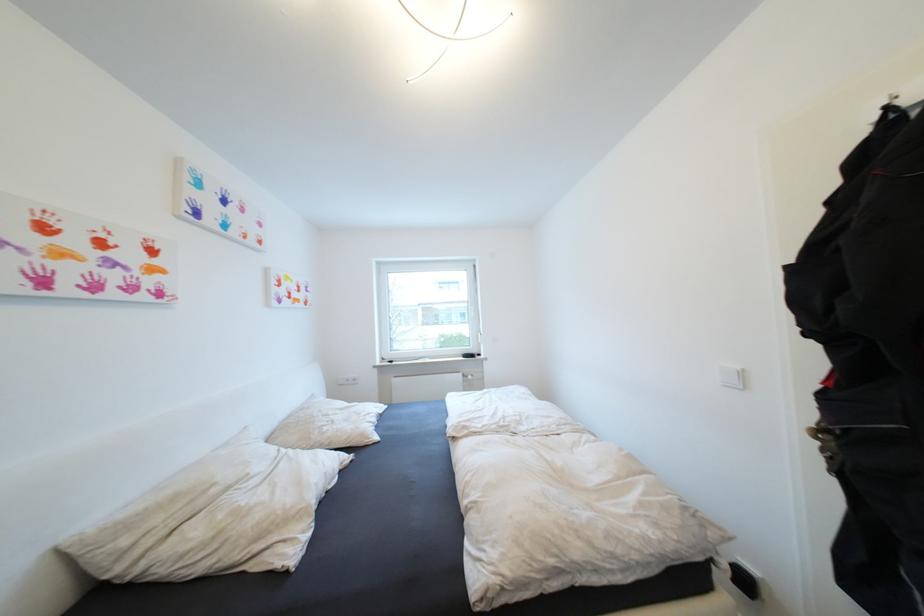
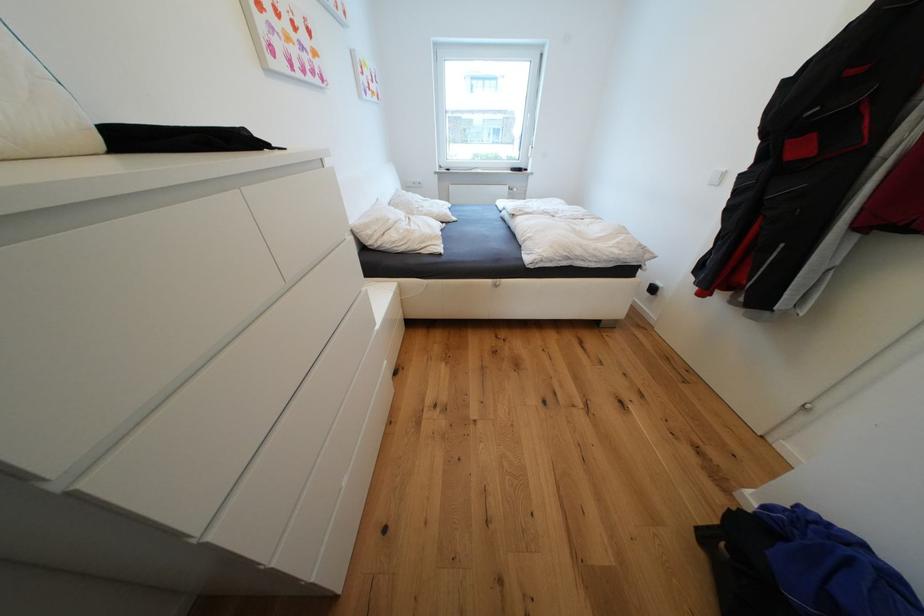
Where in the second image is the point corresponding to pixel 131 543 from the first image?

(377, 233)